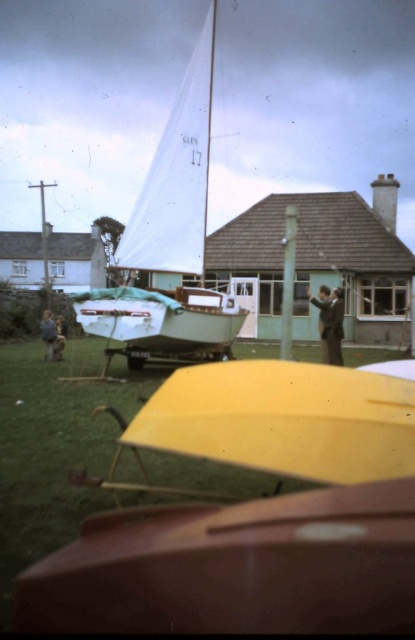
Is point (154, 240) farther from viewer compared to point (46, 320)?

No, it is not.

Can you confirm if white matte sailboat at center is positioned below brown leather jacket at lower left?

Actually, white matte sailboat at center is above brown leather jacket at lower left.

Who is more distant from viewer, (205,49) or (63,348)?

Point (63,348)

Find the location of `white matte sailboat at center`. white matte sailboat at center is located at coordinates (177, 177).

Does point (180, 116) come closer to viewer compared to point (327, 312)?

No, (180, 116) is further to viewer.

Can you confirm if white matte sailboat at center is thinner than dark brown leather jacket at center?

No, white matte sailboat at center is not thinner than dark brown leather jacket at center.

Locate an element on the screen. The width and height of the screenshot is (415, 640). white matte sailboat at center is located at coordinates (177, 177).

Who is more distant from viewer, (337, 323) or (44, 356)?

The point (44, 356) is behind.

Describe the element at coordinates (329, 323) in the screenshot. Image resolution: width=415 pixels, height=640 pixels. I see `dark brown leather jacket at center` at that location.

Where is `dark brown leather jacket at center`? The width and height of the screenshot is (415, 640). dark brown leather jacket at center is located at coordinates (329, 323).